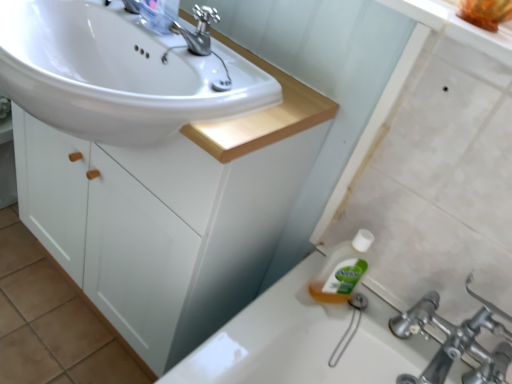
Where is `free space to the right of polished metallic faucet at upper center`? free space to the right of polished metallic faucet at upper center is located at coordinates (271, 95).